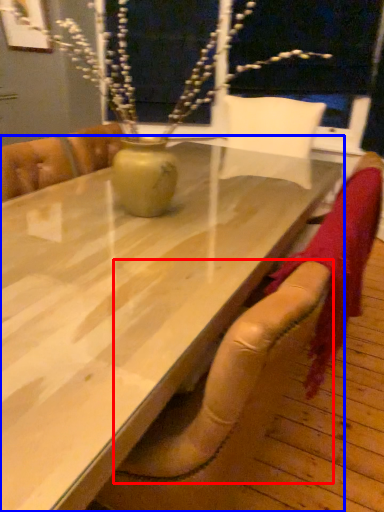
Question: Which of the following is the closest to the observer, armchair (highlighted by a red box) or table (highlighted by a blue box)?

Choices:
 (A) armchair
 (B) table

Answer: (B)